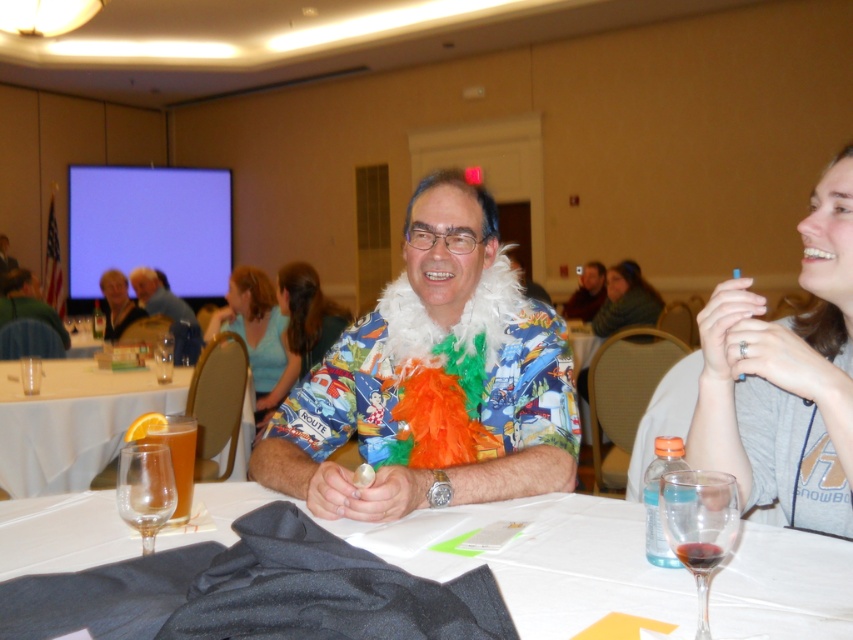
You are a photographer setting up a camera to capture the man in the center of the image. The camera has a focus range that can only handle objects within 10 inches of each other. Are both the hawaiian shirt at center and the silky black fabric at center within the camera focus range?

The hawaiian shirt at center is 10.02 inches from silky black fabric at center. Since the camera can only focus on objects within 10 inches of each other, the distance of 10.02 inches exceeds this limit. Therefore, the camera cannot focus on both the hawaiian shirt at center and the silky black fabric at center simultaneously.

You are standing in the conference room and want to determine the relative positions of two points marked in the image. Which point is closer to you, point (842,205) or point (260,380)?

Point (842,205) is closer to the viewer than point (260,380).

You are organizing a costume party and need to decide which item takes up more space horizontally. You have a hawaiian shirt at center and a silky black fabric at center. Which one is wider?

The silky black fabric at center is wider than the hawaiian shirt at center.